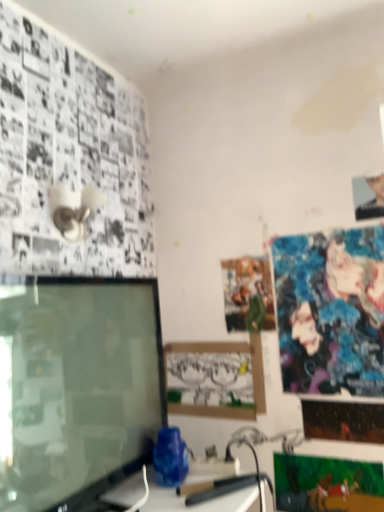
What is the approximate height of shiny metallic poster at lower right, which is the 2th poster page in bottom-to-top order?

shiny metallic poster at lower right, which is the 2th poster page in bottom-to-top order, is 5.66 inches tall.

What do you see at coordinates (368, 197) in the screenshot? I see `smooth skin portrait at upper right` at bounding box center [368, 197].

What is the approximate height of matte green paper at lower right, which is the fourth poster page from top to bottom?

The height of matte green paper at lower right, which is the fourth poster page from top to bottom, is 8.53 inches.

What do you see at coordinates (76, 387) in the screenshot? I see `matte black monitor at left` at bounding box center [76, 387].

Where is `shiny metallic poster at lower right, the 3th poster page from the top`? shiny metallic poster at lower right, the 3th poster page from the top is located at coordinates (343, 421).

From a real-world perspective, between shiny blue fabric poster at upper right, the second poster page in the top-to-bottom sequence, and matte green paper at lower right, which is the fourth poster page from top to bottom, who is vertically higher?

shiny blue fabric poster at upper right, the second poster page in the top-to-bottom sequence.

Does shiny blue fabric poster at upper right, the 3th poster page in the bottom-to-top sequence, turn towards matte green paper at lower right, which is the fourth poster page from top to bottom?

No, shiny blue fabric poster at upper right, the 3th poster page in the bottom-to-top sequence, is not facing towards matte green paper at lower right, which is the fourth poster page from top to bottom.

Considering the sizes of objects shiny blue fabric poster at upper right, the second poster page in the top-to-bottom sequence, and matte green paper at lower right, which is the fourth poster page from top to bottom, in the image provided, who is taller, shiny blue fabric poster at upper right, the second poster page in the top-to-bottom sequence, or matte green paper at lower right, which is the fourth poster page from top to bottom,?

shiny blue fabric poster at upper right, the second poster page in the top-to-bottom sequence.

This screenshot has width=384, height=512. In order to click on poster page that is the 1st object to the right of the matte green paper at lower right, which ranks as the first poster page in bottom-to-top order, starting at the anchor in this screenshot , I will do `click(331, 311)`.

Is matte green paper at lower right, which ranks as the first poster page in bottom-to-top order, beside shiny metallic poster at lower right, which is the 2th poster page in bottom-to-top order?

No.

Is matte green paper at lower right, which ranks as the first poster page in bottom-to-top order, wider than shiny metallic poster at lower right, the 3th poster page from the top?

No, matte green paper at lower right, which ranks as the first poster page in bottom-to-top order, is not wider than shiny metallic poster at lower right, the 3th poster page from the top.

Based on the photo, between matte green paper at lower right, which is the fourth poster page from top to bottom, and shiny metallic poster at lower right, which is the 2th poster page in bottom-to-top order, which one has more height?

With more height is matte green paper at lower right, which is the fourth poster page from top to bottom.

Considering the relative positions of matte green paper at lower right, which ranks as the first poster page in bottom-to-top order, and shiny metallic poster at lower right, the 3th poster page from the top, in the image provided, is matte green paper at lower right, which ranks as the first poster page in bottom-to-top order, to the left or to the right of shiny metallic poster at lower right, the 3th poster page from the top,?

From the image, it's evident that matte green paper at lower right, which ranks as the first poster page in bottom-to-top order, is to the left of shiny metallic poster at lower right, the 3th poster page from the top.

In terms of size, does matte paper poster at center, which ranks as the first poster page in top-to-bottom order, appear bigger or smaller than shiny metallic poster at lower right, the 3th poster page from the top?

Considering their sizes, matte paper poster at center, which ranks as the first poster page in top-to-bottom order, takes up more space than shiny metallic poster at lower right, the 3th poster page from the top.

From a real-world perspective, which object rests below the other?

From a 3D spatial view, shiny metallic poster at lower right, which is the 2th poster page in bottom-to-top order, is below.

Between matte paper poster at center, which appears as the 4th poster page when ordered from the bottom, and shiny metallic poster at lower right, the 3th poster page from the top, which one appears on the left side from the viewer's perspective?

Positioned to the left is matte paper poster at center, which appears as the 4th poster page when ordered from the bottom.

Consider the image. From the image's perspective, is matte paper poster at center, which appears as the 4th poster page when ordered from the bottom, beneath shiny metallic poster at lower right, the 3th poster page from the top?

Incorrect, from the image's perspective, matte paper poster at center, which appears as the 4th poster page when ordered from the bottom, is higher than shiny metallic poster at lower right, the 3th poster page from the top.

Is matte green paper at lower right, which ranks as the first poster page in bottom-to-top order, at the back of matte paper poster at center, which ranks as the first poster page in top-to-bottom order?

matte paper poster at center, which ranks as the first poster page in top-to-bottom order, is not turned away from matte green paper at lower right, which ranks as the first poster page in bottom-to-top order.

Based on their sizes in the image, would you say matte paper poster at center, which ranks as the first poster page in top-to-bottom order, is bigger or smaller than matte green paper at lower right, which ranks as the first poster page in bottom-to-top order?

Clearly, matte paper poster at center, which ranks as the first poster page in top-to-bottom order, is larger in size than matte green paper at lower right, which ranks as the first poster page in bottom-to-top order.

Would you say matte paper poster at center, which ranks as the first poster page in top-to-bottom order, is outside matte green paper at lower right, which ranks as the first poster page in bottom-to-top order?

Yes.

From the image's perspective, is matte black monitor at left on matte paper poster at center, which appears as the 4th poster page when ordered from the bottom?

No.

Can you confirm if matte black monitor at left is smaller than matte paper poster at center, which appears as the 4th poster page when ordered from the bottom?

Incorrect, matte black monitor at left is not smaller in size than matte paper poster at center, which appears as the 4th poster page when ordered from the bottom.

Is matte cardboard picture frame at center located within shiny metallic poster at lower right, which is the 2th poster page in bottom-to-top order?

No, shiny metallic poster at lower right, which is the 2th poster page in bottom-to-top order, does not contain matte cardboard picture frame at center.

How distant is shiny metallic poster at lower right, the 3th poster page from the top, from matte cardboard picture frame at center?

shiny metallic poster at lower right, the 3th poster page from the top, and matte cardboard picture frame at center are 13.32 inches apart.

Which of these two, shiny metallic poster at lower right, which is the 2th poster page in bottom-to-top order, or matte cardboard picture frame at center, is bigger?

matte cardboard picture frame at center is bigger.

Based on the photo, is shiny metallic poster at lower right, which is the 2th poster page in bottom-to-top order, in front of or behind matte cardboard picture frame at center in the image?

In the image, shiny metallic poster at lower right, which is the 2th poster page in bottom-to-top order, appears in front of matte cardboard picture frame at center.

Is point (347, 422) in front of point (124, 326)?

That is False.

Is shiny metallic poster at lower right, the 3th poster page from the top, positioned in front of matte black monitor at left?

No, the depth of shiny metallic poster at lower right, the 3th poster page from the top, is greater than that of matte black monitor at left.

The height and width of the screenshot is (512, 384). What are the coordinates of `television located in front of the shiny metallic poster at lower right, which is the 2th poster page in bottom-to-top order` in the screenshot? It's located at click(x=76, y=387).

Are shiny metallic poster at lower right, which is the 2th poster page in bottom-to-top order, and matte black monitor at left beside each other?

No, shiny metallic poster at lower right, which is the 2th poster page in bottom-to-top order, is not making contact with matte black monitor at left.

At what (x,y) coordinates should I click in order to perform the action: click on the 1st poster page to the left of the shiny blue fabric poster at upper right, the second poster page in the top-to-bottom sequence, counting from the anchor's position. Please return your answer as a coordinate pair (x, y). Looking at the image, I should click on (327, 484).

From the matte green paper at lower right, which is the fourth poster page from top to bottom, count 2nd poster page to the right and point to it. Please provide its 2D coordinates.

[(343, 421)]

Consider the image. Based on their spatial positions, is matte paper poster at center, which appears as the 4th poster page when ordered from the bottom, or matte green paper at lower right, which ranks as the first poster page in bottom-to-top order, closer to shiny blue fabric poster at upper right, the 3th poster page in the bottom-to-top sequence?

matte paper poster at center, which appears as the 4th poster page when ordered from the bottom, is positioned closer to the anchor shiny blue fabric poster at upper right, the 3th poster page in the bottom-to-top sequence.

Based on the photo, from the image, which object appears to be farther from matte black monitor at left, matte paper poster at center, which appears as the 4th poster page when ordered from the bottom, or shiny blue fabric poster at upper right, the 3th poster page in the bottom-to-top sequence?

Among the two, shiny blue fabric poster at upper right, the 3th poster page in the bottom-to-top sequence, is located further to matte black monitor at left.

From the image, which object appears to be farther from matte black monitor at left, matte green paper at lower right, which ranks as the first poster page in bottom-to-top order, or smooth skin portrait at upper right?

Based on the image, smooth skin portrait at upper right appears to be further to matte black monitor at left.

Which object lies further to the anchor point shiny metallic poster at lower right, which is the 2th poster page in bottom-to-top order, matte green paper at lower right, which ranks as the first poster page in bottom-to-top order, or matte cardboard picture frame at center?

Based on the image, matte cardboard picture frame at center appears to be further to shiny metallic poster at lower right, which is the 2th poster page in bottom-to-top order.

Estimate the real-world distances between objects in this image. Which object is closer to matte cardboard picture frame at center, shiny blue fabric poster at upper right, the 3th poster page in the bottom-to-top sequence, or smooth skin portrait at upper right?

Based on the image, shiny blue fabric poster at upper right, the 3th poster page in the bottom-to-top sequence, appears to be nearer to matte cardboard picture frame at center.

Estimate the real-world distances between objects in this image. Which object is further from smooth skin portrait at upper right, matte black monitor at left or matte green paper at lower right, which is the fourth poster page from top to bottom?

The object further to smooth skin portrait at upper right is matte black monitor at left.

Looking at this image, considering their positions, is matte paper poster at center, which ranks as the first poster page in top-to-bottom order, positioned further to shiny blue fabric poster at upper right, the second poster page in the top-to-bottom sequence, than shiny metallic poster at lower right, the 3th poster page from the top?

Based on the image, shiny metallic poster at lower right, the 3th poster page from the top, appears to be further to shiny blue fabric poster at upper right, the second poster page in the top-to-bottom sequence.

Looking at the image, which one is located closer to shiny metallic poster at lower right, the 3th poster page from the top, matte green paper at lower right, which is the fourth poster page from top to bottom, or matte black monitor at left?

matte green paper at lower right, which is the fourth poster page from top to bottom, is positioned closer to the anchor shiny metallic poster at lower right, the 3th poster page from the top.

At what (x,y) coordinates should I click in order to perform the action: click on picture frame between shiny blue fabric poster at upper right, the second poster page in the top-to-bottom sequence, and matte green paper at lower right, which is the fourth poster page from top to bottom, in the vertical direction. Please return your answer as a coordinate pair (x, y). Looking at the image, I should click on (216, 378).

The image size is (384, 512). Find the location of `poster page between shiny blue fabric poster at upper right, the second poster page in the top-to-bottom sequence, and matte green paper at lower right, which ranks as the first poster page in bottom-to-top order, in the vertical direction`. poster page between shiny blue fabric poster at upper right, the second poster page in the top-to-bottom sequence, and matte green paper at lower right, which ranks as the first poster page in bottom-to-top order, in the vertical direction is located at coordinates (343, 421).

This screenshot has height=512, width=384. I want to click on person between matte black monitor at left and matte paper poster at center, which ranks as the first poster page in top-to-bottom order, along the z-axis, so 368,197.

Image resolution: width=384 pixels, height=512 pixels. I want to click on picture frame between smooth skin portrait at upper right and matte green paper at lower right, which ranks as the first poster page in bottom-to-top order, in the vertical direction, so click(216, 378).